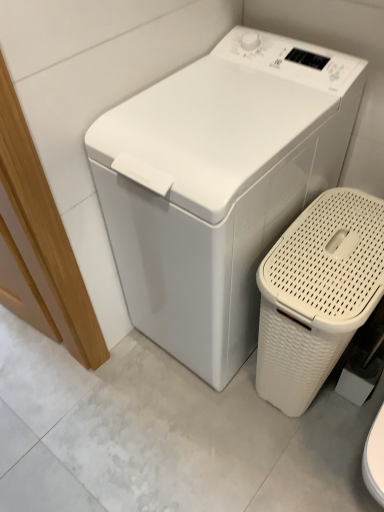
You are a GUI agent. You are given a task and a screenshot of the screen. Output one action in this format:
    pyautogui.click(x=<x>, y=<y>)
    Task: Click on the vacant space that is to the left of white woven basket at lower right
    Image resolution: width=384 pixels, height=512 pixels.
    Given the screenshot: What is the action you would take?
    pyautogui.click(x=205, y=421)